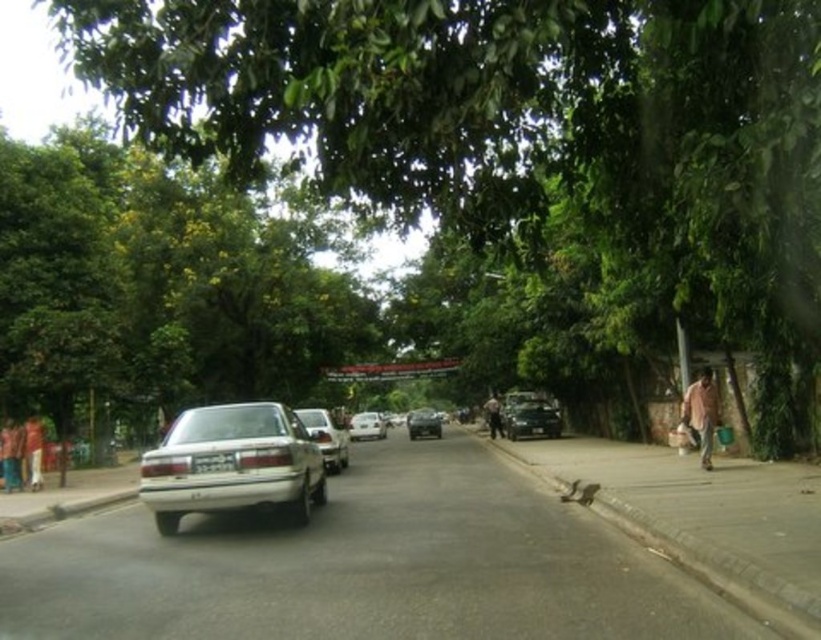
Who is lower down, matte pink shirt at left or white matte car at center?

white matte car at center

From the picture: Between matte pink shirt at left and white matte car at center, which one has less height?

matte pink shirt at left is shorter.

Describe the element at coordinates (33, 451) in the screenshot. The width and height of the screenshot is (821, 640). I see `matte pink shirt at left` at that location.

You are a GUI agent. You are given a task and a screenshot of the screen. Output one action in this format:
    pyautogui.click(x=<x>, y=<y>)
    Task: Click on the matte pink shirt at left
    The image size is (821, 640).
    Given the screenshot: What is the action you would take?
    pyautogui.click(x=33, y=451)

Between silver metallic sedan at center and brown leather jacket at center, which one appears on the left side from the viewer's perspective?

silver metallic sedan at center is more to the left.

Who is higher up, silver metallic sedan at center or brown leather jacket at center?

Positioned higher is silver metallic sedan at center.

Who is more forward, (328, 422) or (487, 422)?

Point (328, 422)

At what (x,y) coordinates should I click in order to perform the action: click on silver metallic sedan at center. Please return your answer as a coordinate pair (x, y). Image resolution: width=821 pixels, height=640 pixels. Looking at the image, I should click on (326, 436).

Is shiny black car at right positioned behind satin black car at center?

No.

How distant is shiny black car at right from satin black car at center?

shiny black car at right and satin black car at center are 20.71 meters apart from each other.

Does point (535, 412) come farther from viewer compared to point (409, 422)?

No, (535, 412) is in front of (409, 422).

At what (x,y) coordinates should I click in order to perform the action: click on shiny black car at right. Please return your answer as a coordinate pair (x, y). The height and width of the screenshot is (640, 821). Looking at the image, I should click on (531, 419).